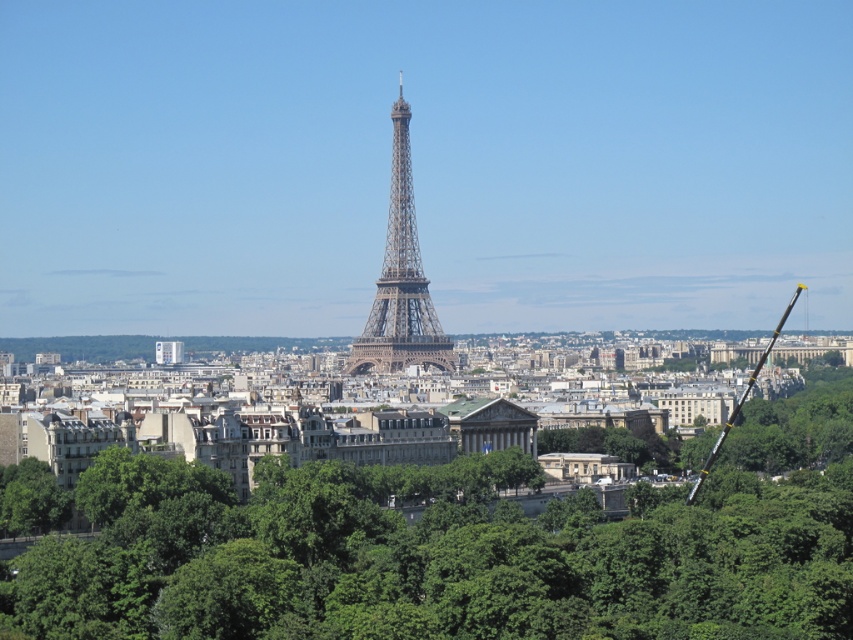
You are standing in front of the metallic lattice tower at center and want to take a photo of the green leafy tree at center. Which direction should you turn to face the tree?

You should turn to your right to face the green leafy tree at center, as it is located to the right of the metallic lattice tower at center.

You are a tourist standing in front of the Eiffel Tower and see the green leafy tree at center and the metallic lattice tower at center. Which object is positioned lower in the scene?

The green leafy tree at center is positioned below the metallic lattice tower at center, so it is lower in the scene.